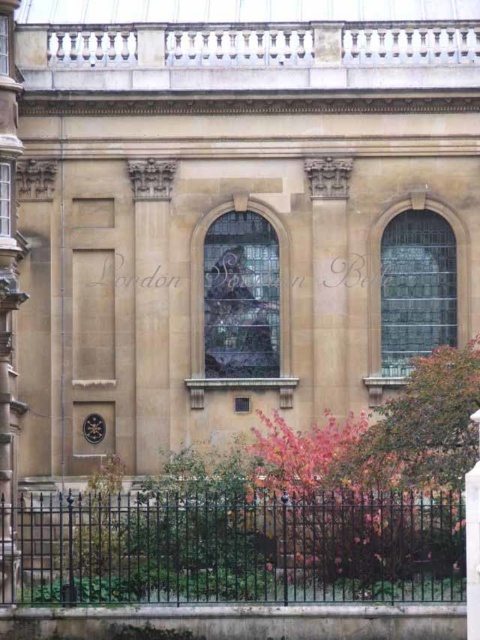
Question: Can you confirm if black wrought iron fence at lower center is thinner than sandy stone column at center?

Choices:
 (A) yes
 (B) no

Answer: (B)

Question: Is black wrought iron fence at lower center smaller than sandy stone column at center?

Choices:
 (A) no
 (B) yes

Answer: (A)

Question: Based on their relative distances, which object is farther from the smooth stone pillar at left?

Choices:
 (A) sandy stone column at center
 (B) black wrought iron fence at lower center

Answer: (A)

Question: Does smooth stone pillar at left lie behind sandy stone column at center?

Choices:
 (A) yes
 (B) no

Answer: (A)

Question: Among these points, which one is farthest from the camera?

Choices:
 (A) (1, 324)
 (B) (419, 504)

Answer: (A)

Question: Which of the following is the closest to the observer?

Choices:
 (A) smooth stone pillar at left
 (B) black wrought iron fence at lower center

Answer: (B)